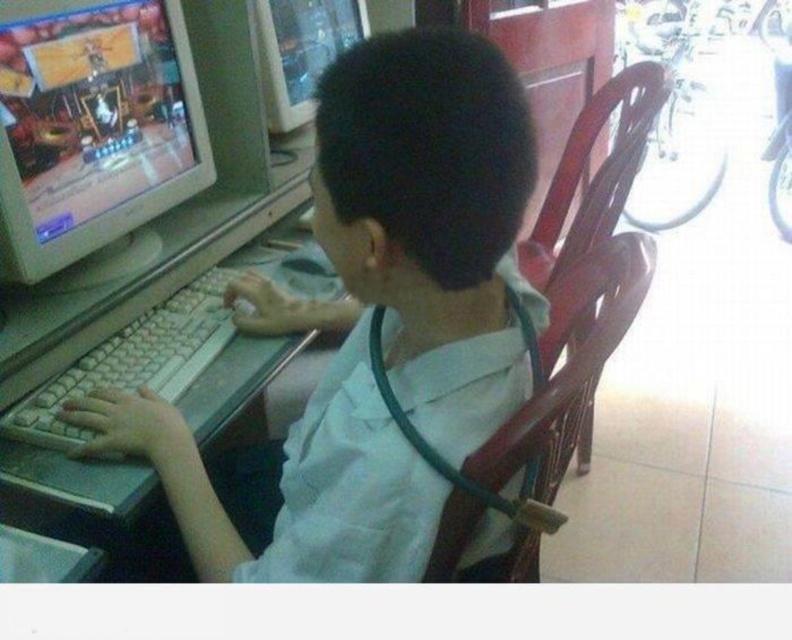
You are a delivery person who needs to place a new mouse pad between the matte plastic monitor at left and the white plastic keyboard at center. The mouse pad is 10 inches long. Will it fit between them without overlapping either object?

The distance between the matte plastic monitor at left and the white plastic keyboard at center is 9.40 inches. Since the mouse pad is 10 inches long, it will not fit between them without overlapping one or both objects.

Looking at this image, you are a photographer taking a picture of the boy. You notice the white matte shirt at center and the wooden chair at right. To ensure both are fully visible in the frame, should you adjust your camera to focus more on the left or the right side of the scene?

You should focus more on the left side of the scene because the white matte shirt at center is to the left of the wooden chair at right, so positioning the focus on the left will capture both objects within the frame.

You are a spatial reasoning expert. The scene has a point labeled as point (92, 125). Based on the scene description, where is this point located?

The point (92, 125) is located on the matte plastic monitor at left.